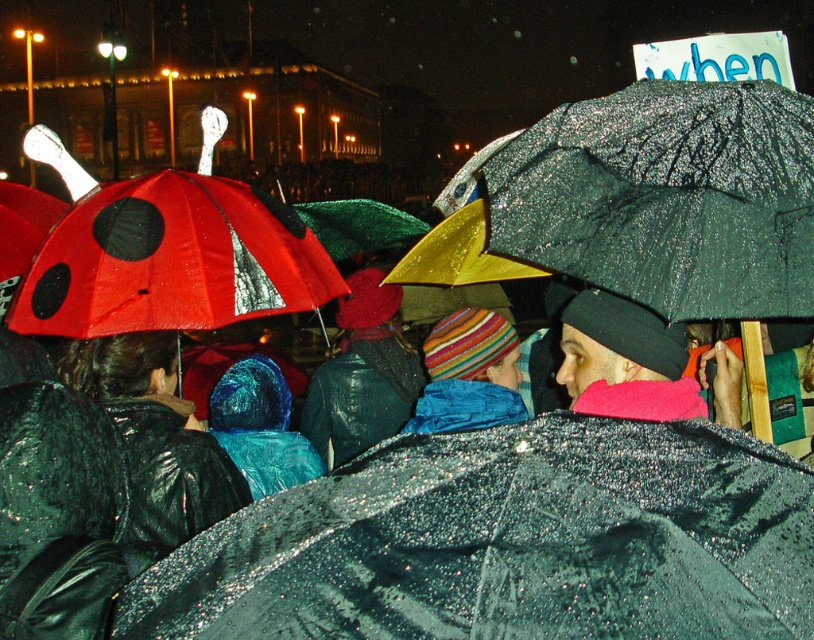
You are a photographer trying to capture a clear shot of the shiny blue jacket at center during the protest. However, the shiny black umbrella at center is blocking your view. Can you estimate how much you need to move your camera position to the side to avoid the obstruction?

The shiny black umbrella at center is closer to the viewer than the shiny blue jacket at center. To avoid the obstruction, you would need to move your camera position sideways until the umbrella is no longer in front of the jacket.

You are a photographer trying to capture a clear shot of the shiny blue jacket at center without the shiny black umbrella at center obstructing the view. Based on their sizes, is it possible to frame the jacket without the umbrella overlapping?

The shiny black umbrella at center might be wider than shiny blue jacket at center, so there is a possibility that the umbrella could overlap the jacket in the frame. To ensure a clear shot, you might need to adjust your angle or position to avoid the umbrella.